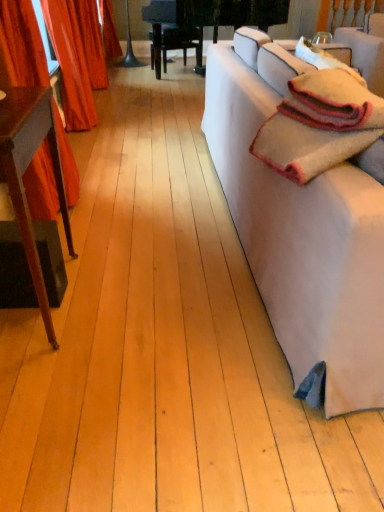
Find the location of a particular element. free spot to the right of mahogany wood table at left is located at coordinates (129, 302).